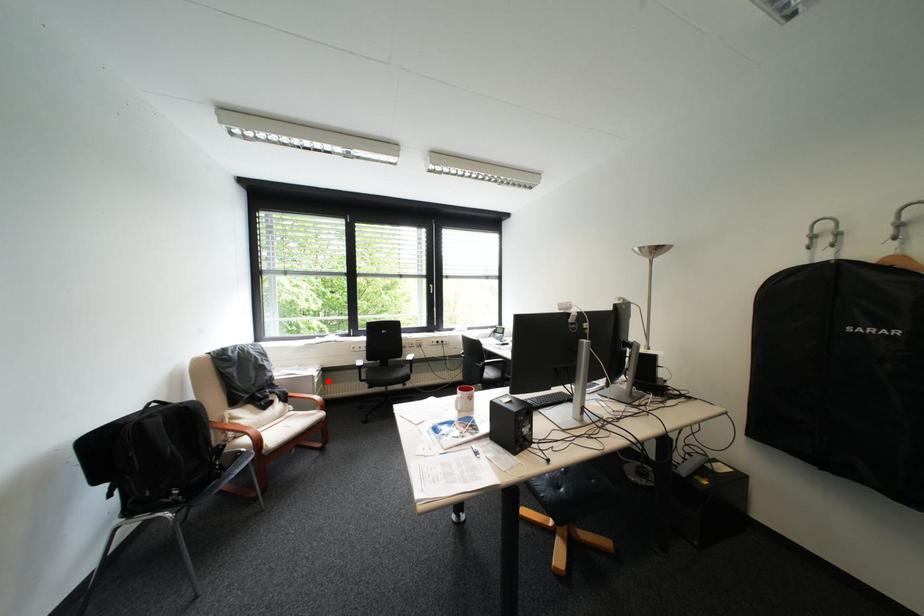
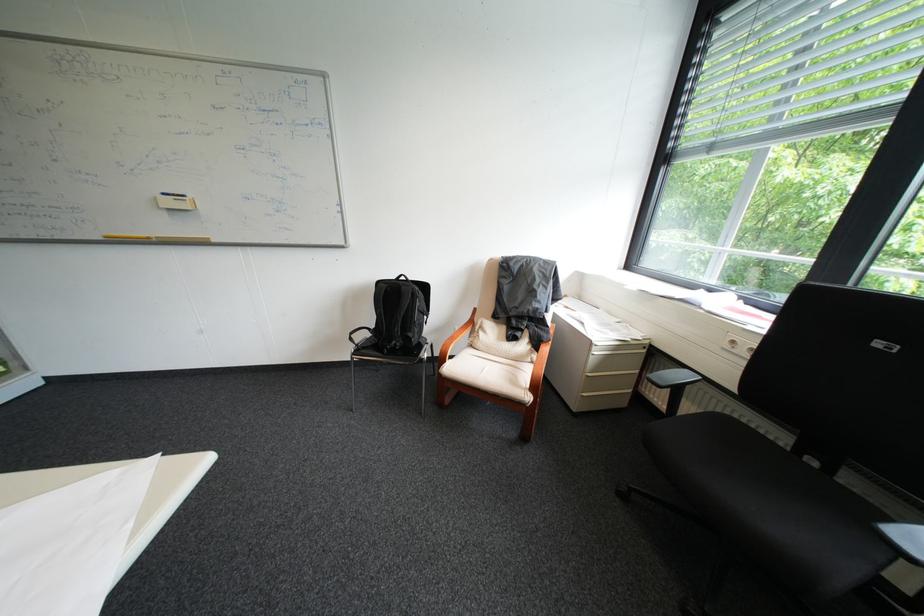
Question: I am providing you with two images of the same scene from different viewpoints. In image1, a red point is highlighted. Considering the same 3D point in image2, which of the following is correct?

Choices:
 (A) It is closer
 (B) It is farther

Answer: (A)